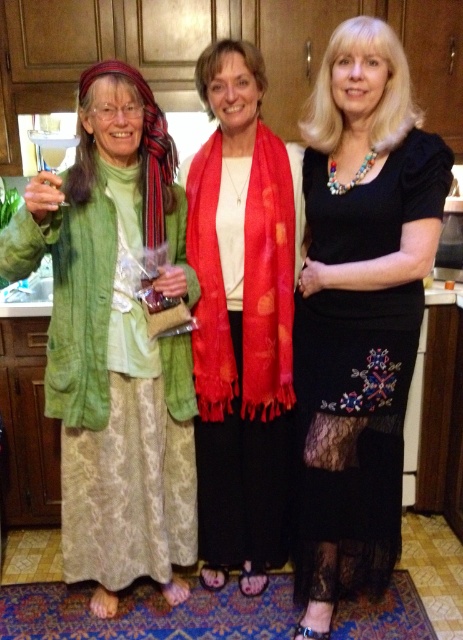
Question: Does green textured cardigan at left have a larger size compared to silky red scarf at center?

Choices:
 (A) yes
 (B) no

Answer: (A)

Question: Is black lace dress at center in front of silky red scarf at center?

Choices:
 (A) no
 (B) yes

Answer: (B)

Question: Which object is closer to the camera taking this photo?

Choices:
 (A) green textured cardigan at left
 (B) silky red scarf at center
 (C) black lace dress at center

Answer: (A)

Question: Which object is farther from the camera taking this photo?

Choices:
 (A) green textured cardigan at left
 (B) silky red scarf at center
 (C) black lace dress at center

Answer: (B)

Question: Does black lace dress at center appear on the left side of silky red scarf at center?

Choices:
 (A) no
 (B) yes

Answer: (A)

Question: Among these points, which one is nearest to the camera?

Choices:
 (A) (325, 253)
 (B) (144, 515)

Answer: (A)